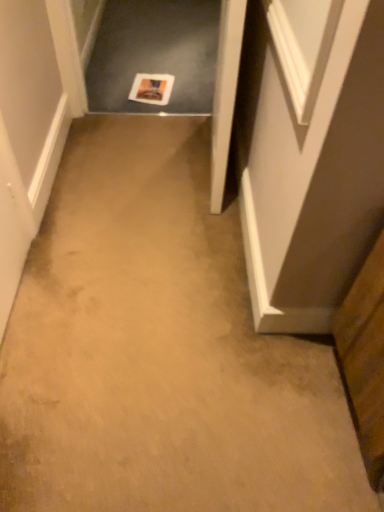
Question: Based on their sizes in the image, would you say wooden cabinet at lower right is bigger or smaller than white wood door at center?

Choices:
 (A) small
 (B) big

Answer: (A)

Question: Is point (359, 302) positioned closer to the camera than point (228, 46)?

Choices:
 (A) closer
 (B) farther

Answer: (A)

Question: Estimate the real-world distances between objects in this image. Which object is closer to the white wood door at center?

Choices:
 (A) wooden cabinet at lower right
 (B) white paper at center

Answer: (A)

Question: Which is farther from the white paper at center?

Choices:
 (A) white wood door at center
 (B) wooden cabinet at lower right

Answer: (B)